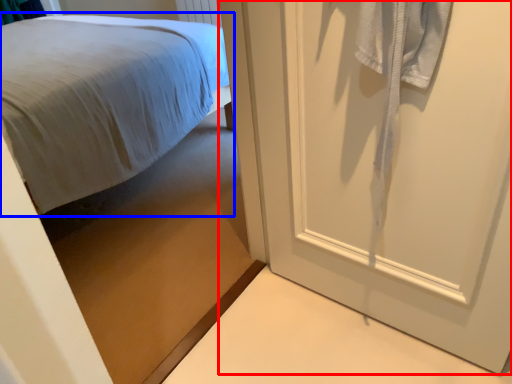
Question: Which point is further to the camera, door (highlighted by a red box) or bed (highlighted by a blue box)?

Choices:
 (A) door
 (B) bed

Answer: (B)